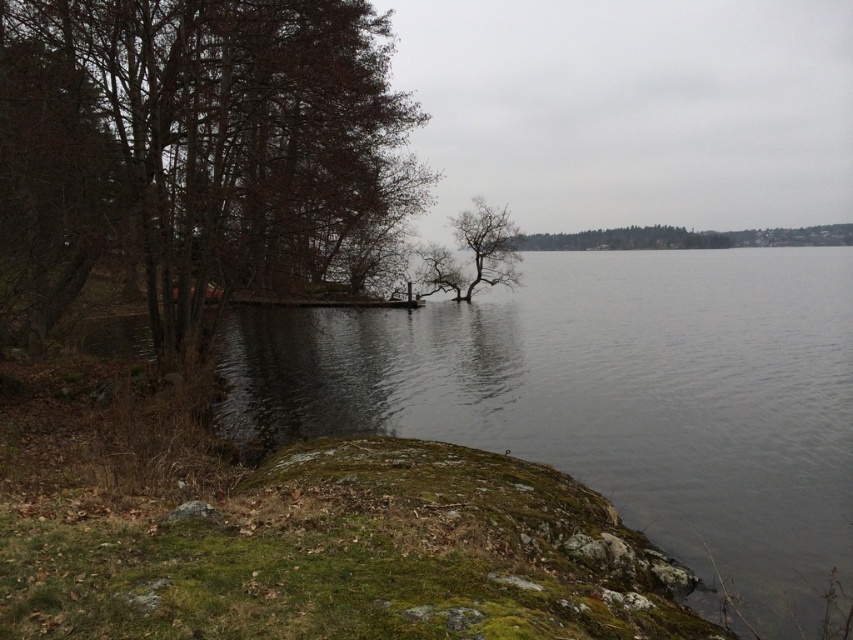
Can you confirm if clear water at lower left is thinner than bare branches at center?

No.

Does clear water at lower left have a greater height compared to bare branches at center?

Yes, clear water at lower left is taller than bare branches at center.

Is point (527, 323) positioned behind point (419, 284)?

No, it is in front of (419, 284).

The height and width of the screenshot is (640, 853). Find the location of `clear water at lower left`. clear water at lower left is located at coordinates (608, 397).

Where is `brown leafy tree at left`? brown leafy tree at left is located at coordinates (199, 145).

Can you confirm if brown leafy tree at left is positioned above bare branches at center?

Yes.

Which is in front, point (131, 122) or point (489, 250)?

Point (131, 122) is more forward.

The height and width of the screenshot is (640, 853). I want to click on brown leafy tree at left, so click(x=199, y=145).

Can you confirm if bare branches at center is wider than green leafy tree at center?

In fact, bare branches at center might be narrower than green leafy tree at center.

Is point (426, 275) farther from camera compared to point (560, 244)?

No, it is not.

Between point (438, 278) and point (618, 248), which one is positioned in front?

Point (438, 278)

The image size is (853, 640). Identify the location of bare branches at center. (473, 253).